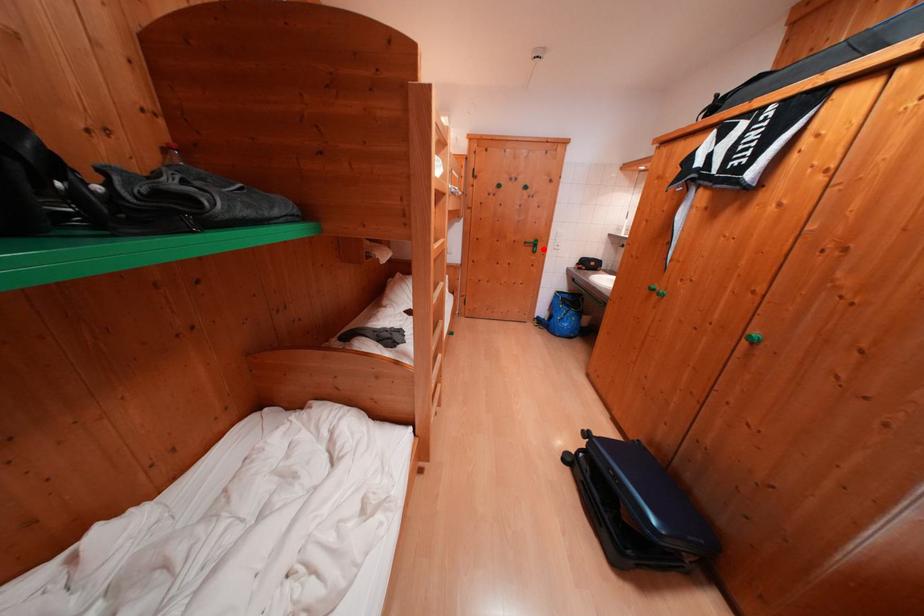
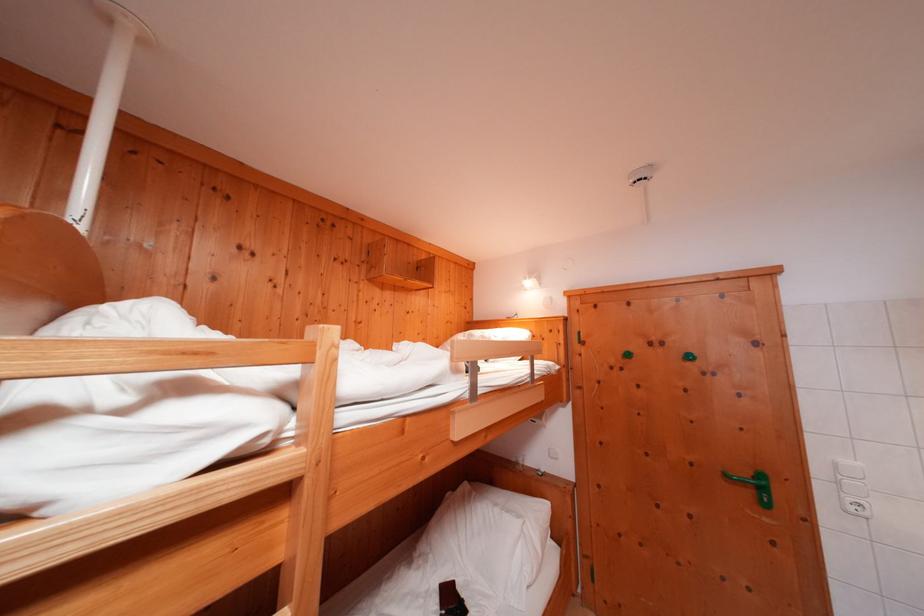
The point at the highlighted location is marked in the first image. Where is the corresponding point in the second image?

(771, 493)